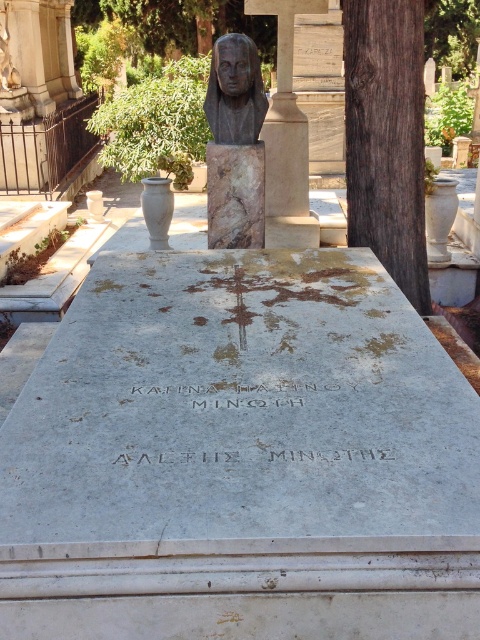
Does dark brown wood at right appear under matte bronze bust at center?

Indeed, dark brown wood at right is positioned under matte bronze bust at center.

Describe the element at coordinates (386, 138) in the screenshot. Image resolution: width=480 pixels, height=640 pixels. I see `dark brown wood at right` at that location.

Is point (408, 150) closer to viewer compared to point (231, 44)?

Yes.

Find the location of a particular element. dark brown wood at right is located at coordinates (386, 138).